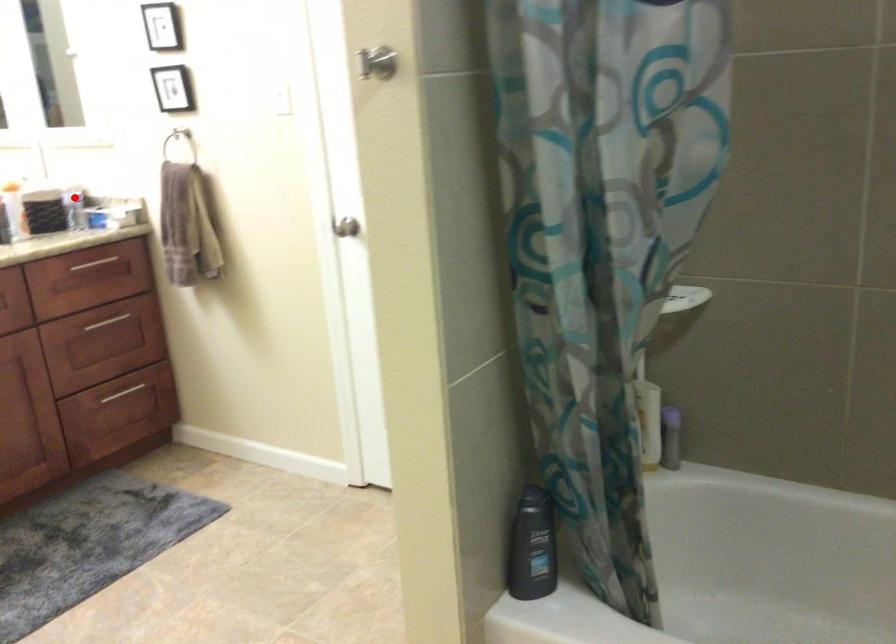
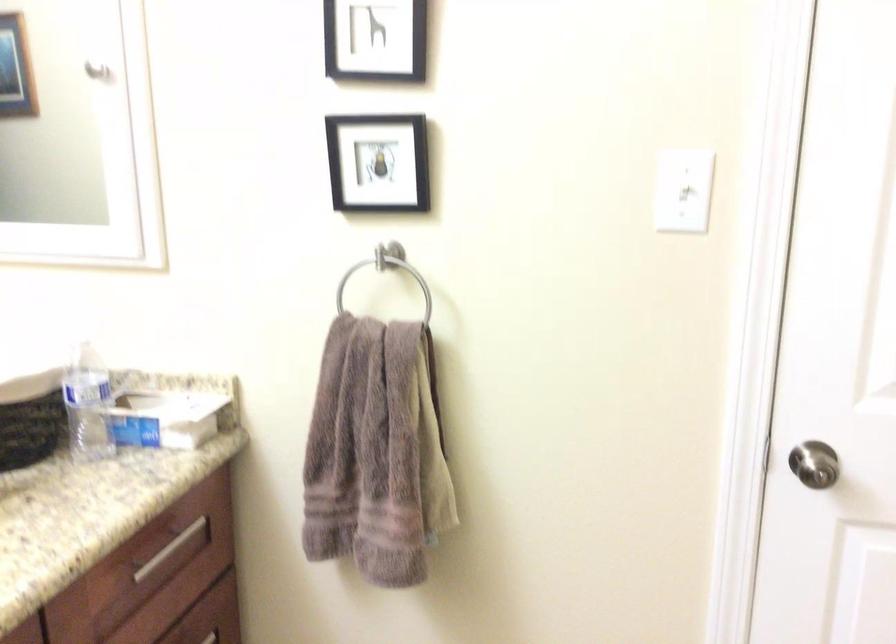
Question: I am providing you with two images of the same scene from different viewpoints. Image1 has a red point marked. In image2, the corresponding 3D location appears at what relative position? Reply with the corresponding letter.

Choices:
 (A) Closer
 (B) Farther

Answer: (A)